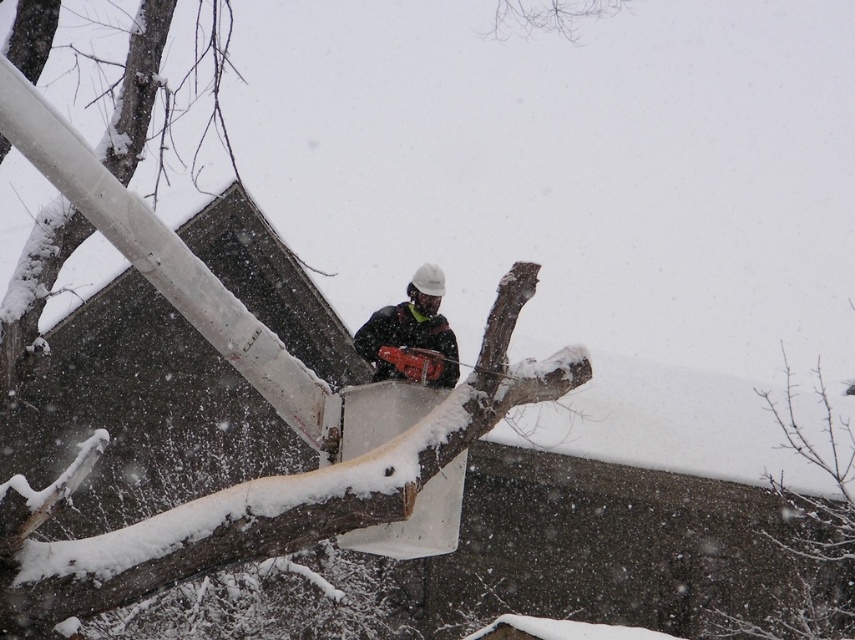
Consider the image. Between brown rough wood at center and snow-covered branch at lower right, which one appears on the left side from the viewer's perspective?

Positioned to the left is brown rough wood at center.

Is brown rough wood at center wider than snow-covered branch at lower right?

Incorrect, brown rough wood at center's width does not surpass snow-covered branch at lower right's.

Which is behind, point (494, 419) or point (793, 621)?

The point (793, 621) is more distant.

Image resolution: width=855 pixels, height=640 pixels. I want to click on brown rough wood at center, so click(x=258, y=394).

Is snow-covered branch at lower right wider than matte black chainsaw at center?

Yes.

How distant is snow-covered branch at lower right from matte black chainsaw at center?

snow-covered branch at lower right and matte black chainsaw at center are 36.02 feet apart from each other.

Measure the distance between snow-covered branch at lower right and camera.

18.23 meters

What are the coordinates of `snow-covered branch at lower right` in the screenshot? It's located at (806, 536).

Does brown rough wood at center have a lesser height compared to matte black chainsaw at center?

Yes, brown rough wood at center is shorter than matte black chainsaw at center.

Can you confirm if brown rough wood at center is positioned below matte black chainsaw at center?

Yes.

Is point (388, 452) closer to viewer compared to point (450, 372)?

Yes, point (388, 452) is in front of point (450, 372).

Locate an element on the screen. brown rough wood at center is located at coordinates (258, 394).